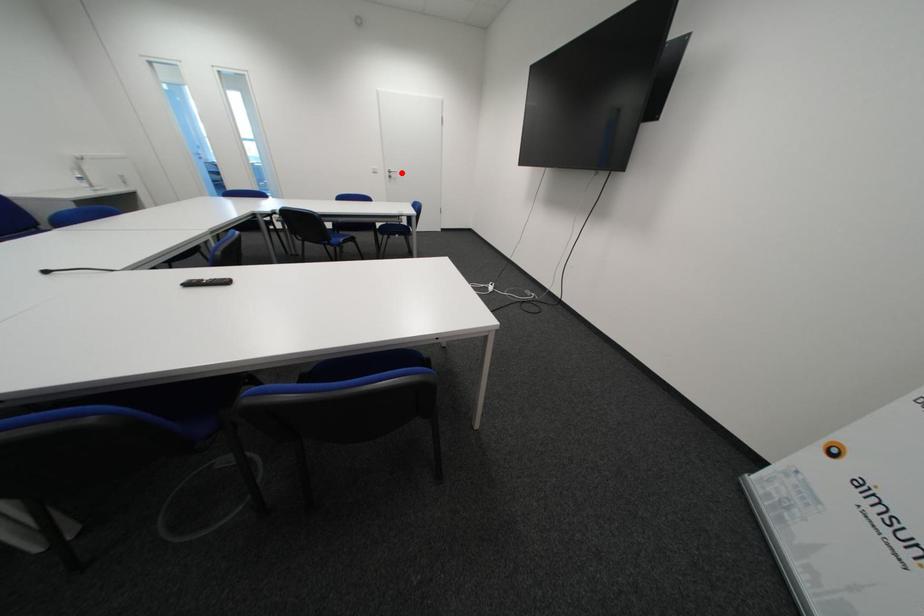
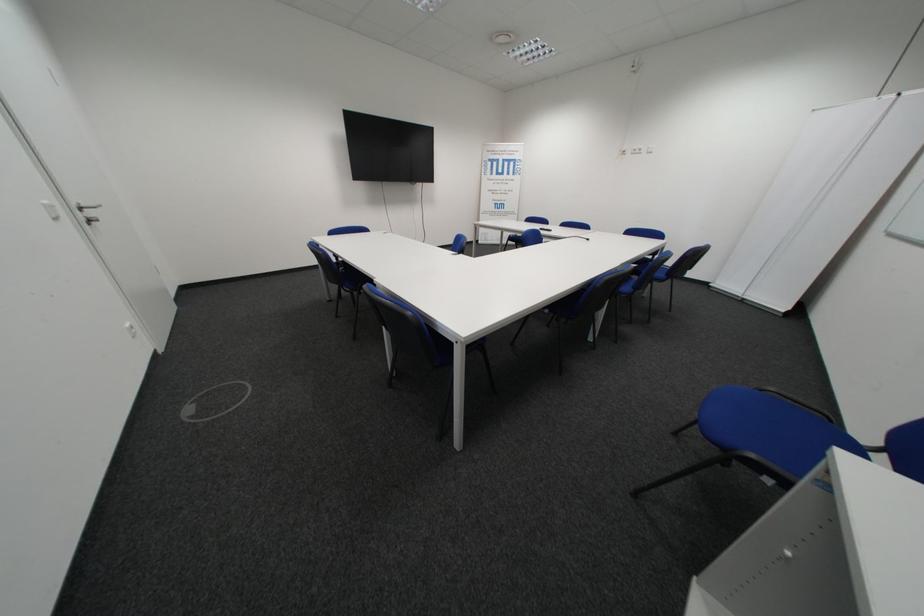
Question: I am providing you with two images of the same scene from different viewpoints. A red point is shown in image1. For the corresponding object point in image2, is it positioned nearer or farther from the camera?

Choices:
 (A) Nearer
 (B) Farther

Answer: (B)